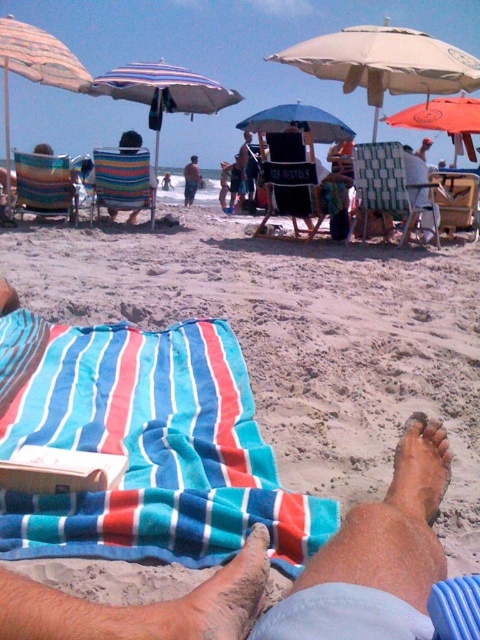
Question: Can you confirm if black mesh chair at center is smaller than blue striped towel at center?

Choices:
 (A) no
 (B) yes

Answer: (A)

Question: Which of the following is the farthest from the observer?

Choices:
 (A) green woven beach chair at center
 (B) beige fabric umbrella at upper left
 (C) blue striped towel at lower center
 (D) orange fabric umbrella at upper right

Answer: (D)

Question: Is blue striped towel at lower center positioned in front of beige fabric umbrella at center?

Choices:
 (A) yes
 (B) no

Answer: (A)

Question: Which of these objects is positioned closest to the green woven beach chair at center?

Choices:
 (A) brown rough skin at lower center
 (B) striped fabric beach chair at left
 (C) blue striped towel at center
 (D) wooden chair at center

Answer: (D)

Question: Which object is closer to the camera taking this photo?

Choices:
 (A) blue striped towel at lower left
 (B) striped fabric beach chair at center
 (C) black mesh chair at center

Answer: (A)

Question: Does beige fabric umbrella at center appear on the right side of black mesh chair at center?

Choices:
 (A) yes
 (B) no

Answer: (A)